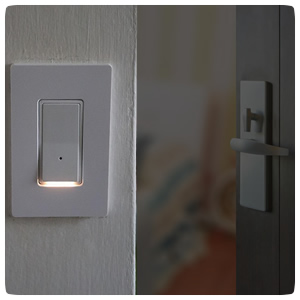
Locate an element on the screen. This screenshot has height=300, width=300. door is located at coordinates (260, 46).